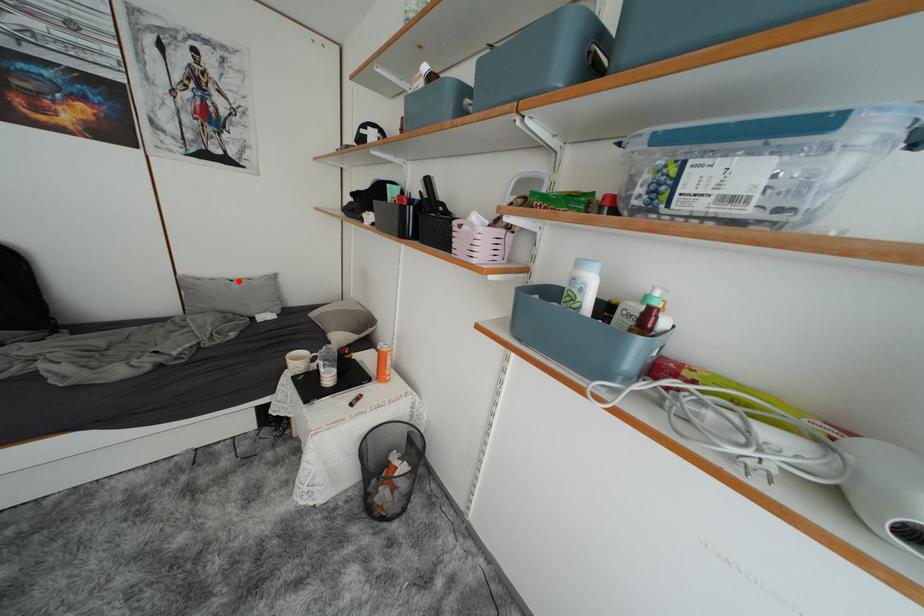
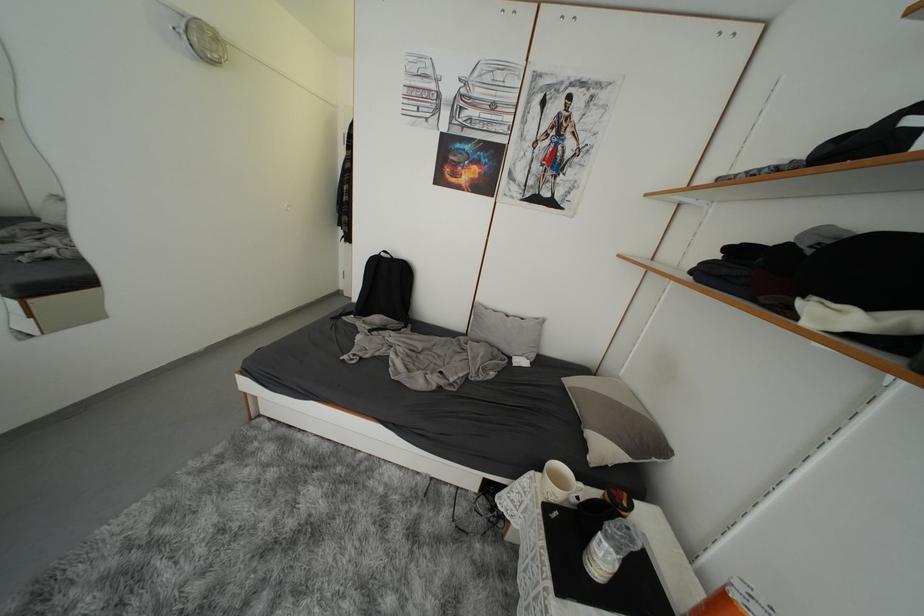
Where in the second image is the point corresponding to the highlighted location from the first image?

(516, 315)